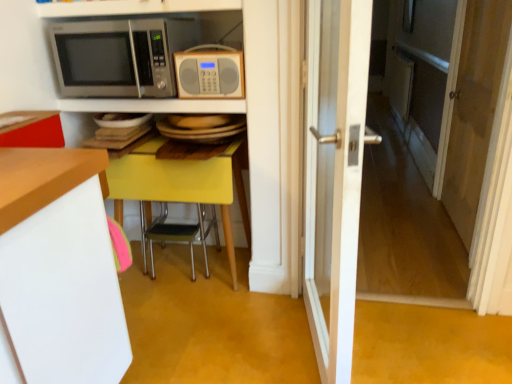
Question: Looking at the image, does metallic silver microwave at upper center, positioned as the 1th shelf in bottom-to-top order, seem bigger or smaller compared to white wooden door at center?

Choices:
 (A) big
 (B) small

Answer: (B)

Question: Is metallic silver microwave at upper center, which is the second shelf from top to bottom, spatially inside white wooden door at center, or outside of it?

Choices:
 (A) outside
 (B) inside

Answer: (A)

Question: Which is farther from the white glossy shelf at upper center, acting as the 2th shelf starting from the bottom?

Choices:
 (A) satin silver microwave at upper left, which ranks as the second microwave oven in right-to-left order
 (B) transparent glass door at right
 (C) white wooden door at center
 (D) yellow glossy table at center
 (E) metallic yellow chair at center

Answer: (B)

Question: Which of these objects is positioned closest to the transparent glass door at right?

Choices:
 (A) white wooden door at center
 (B) metallic silver microwave at upper center, positioned as the 1th shelf in bottom-to-top order
 (C) matte gray radio at center, marked as the first microwave oven in a right-to-left arrangement
 (D) yellow glossy table at center
 (E) metallic yellow chair at center

Answer: (A)